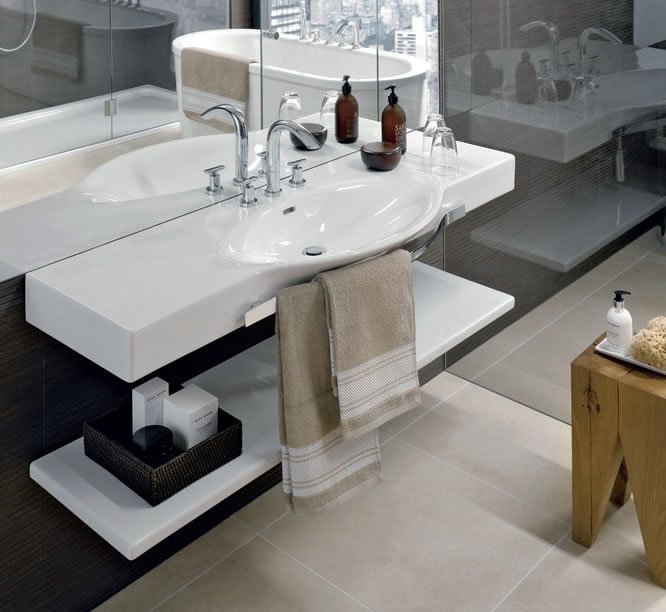
Find the location of a particular element. Image resolution: width=666 pixels, height=612 pixels. upside down glass is located at coordinates (428, 128).